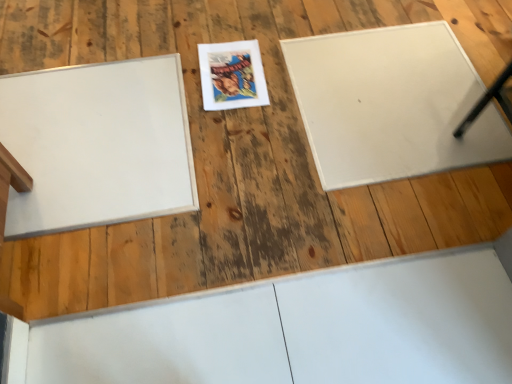
Identify the location of free area below matte paper comic book at center (from a real-world perspective). (234, 77).